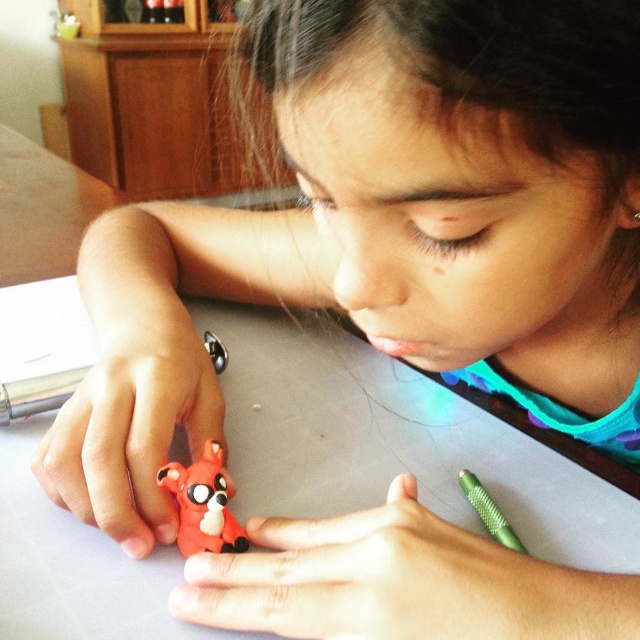
Based on the scene description, where is the rubberized red fox at center located in terms of its 2D coordinates?

The rubberized red fox at center is located at the 2D coordinates of point (202,504).

Based on the scene description, what object is positioned at the coordinates point (202, 504)?

The rubberized red fox at center is located at point (202, 504).

Looking at this image, you are trying to determine which of the two points, point (188,481) or point (490,508), is closer to you in the image. Based on the scene, can you figure out which one is nearer?

Point (188,481) is closer to the viewer than point (490,508), so it is the nearer one.